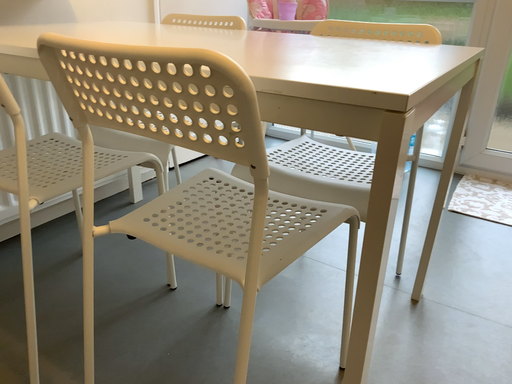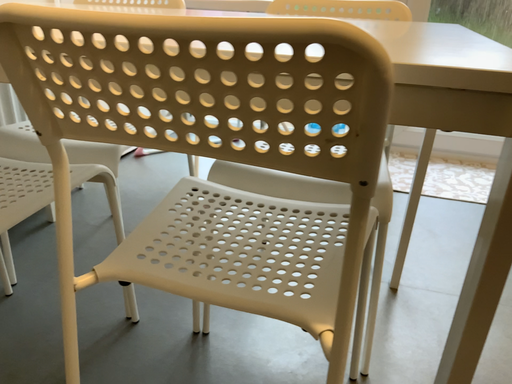
Question: How did the camera likely rotate when shooting the video?

Choices:
 (A) rotated right
 (B) rotated left

Answer: (A)